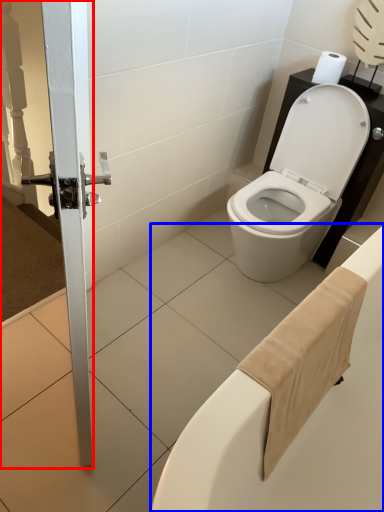
Question: Which of the following is the farthest to the observer, screen door (highlighted by a red box) or bath (highlighted by a blue box)?

Choices:
 (A) screen door
 (B) bath

Answer: (B)